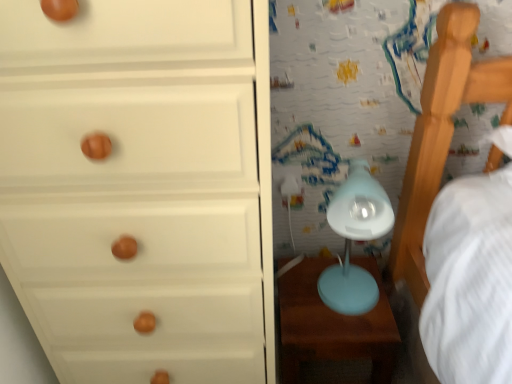
Where is `free location to the left of matte blue table lamp at center-right`? This screenshot has width=512, height=384. free location to the left of matte blue table lamp at center-right is located at coordinates (300, 300).